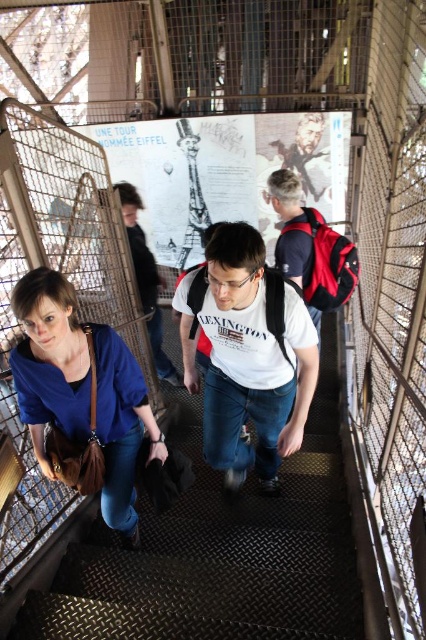
Question: Does matte white poster at center come in front of blue fabric shirt at lower left?

Choices:
 (A) yes
 (B) no

Answer: (B)

Question: Which object is the closest to the white cotton t-shirt at center?

Choices:
 (A) matte white poster at center
 (B) white matte t-shirt at center

Answer: (A)

Question: Does matte white poster at center appear under white matte t-shirt at center?

Choices:
 (A) no
 (B) yes

Answer: (A)

Question: Based on their relative distances, which object is farther from the white cotton t-shirt at center?

Choices:
 (A) black metal stairs at center
 (B) blue fabric shirt at lower left
 (C) matte white poster at center
 (D) white matte t-shirt at center

Answer: (B)

Question: Which of the following is the closest to the observer?

Choices:
 (A) matte white poster at center
 (B) white cotton t-shirt at center

Answer: (B)

Question: Considering the relative positions of blue fabric shirt at lower left and white cotton t-shirt at center in the image provided, where is blue fabric shirt at lower left located with respect to white cotton t-shirt at center?

Choices:
 (A) above
 (B) below

Answer: (B)